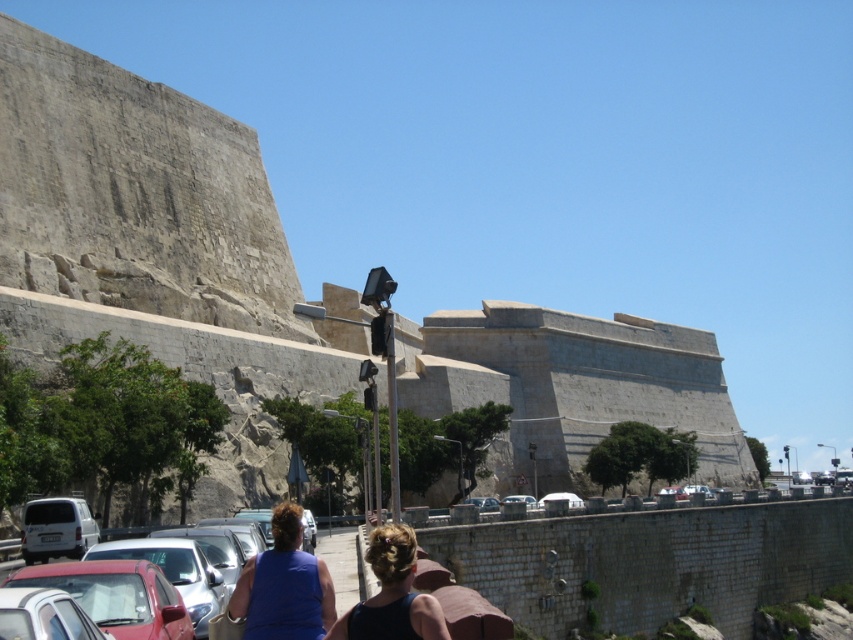
You are standing at the base of the historic stone wall and want to determine which of the two points, point (424,634) or point (488,500), is nearer to you. Based on the scene, which point is closer?

Point (424,634) is closer to the viewer than point (488,500).